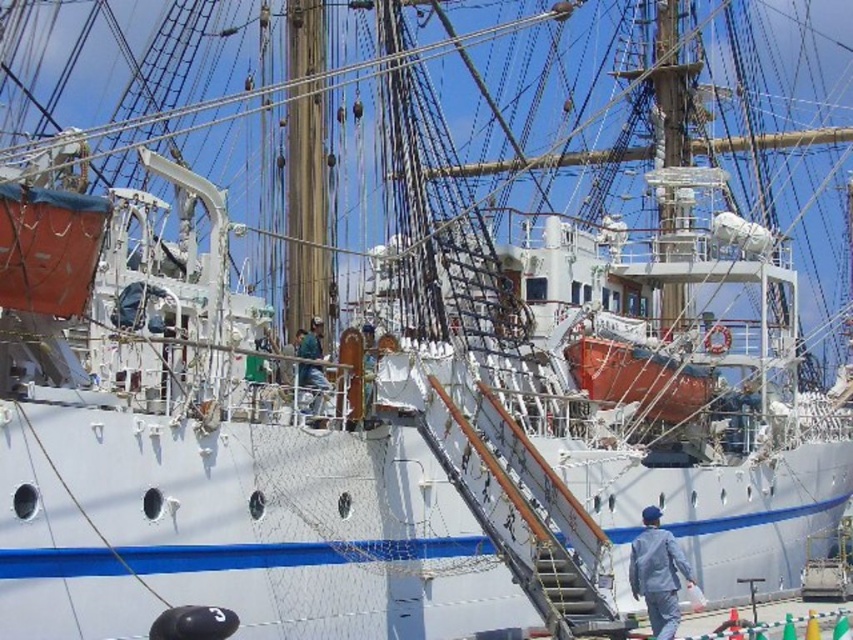
You are standing on the deck of the ship and see two crew members wearing the light blue fabric jacket at lower right and the green matte shirt at center. Which crew member is closer to the right side of the deck?

The light blue fabric jacket at lower right is positioned on the right side of green matte shirt at center, so the crew member wearing the light blue fabric jacket at lower right is closer to the right side of the deck.

You are standing on the dock next to the ship and want to hand a message to the person wearing the light blue fabric jacket at lower right and the green matte shirt at center. Which person should you aim lower to reach?

You should aim lower to reach the light blue fabric jacket at lower right because it is closer to the viewer than the green matte shirt at center.

You are a photographer standing at the camera position. You want to take a closeup photo of the light blue fabric jacket at lower right. Considering the jacket is 82.35 meters away, can you capture it clearly with a standard zoom lens that has a maximum zoom of 200mm?

The light blue fabric jacket at lower right is 82.35 meters away from the camera. A standard zoom lens with a maximum of 200mm may not provide sufficient magnification to capture the jacket clearly at that distance. A telephoto lens with a longer focal length would be more appropriate for such a distant subject.